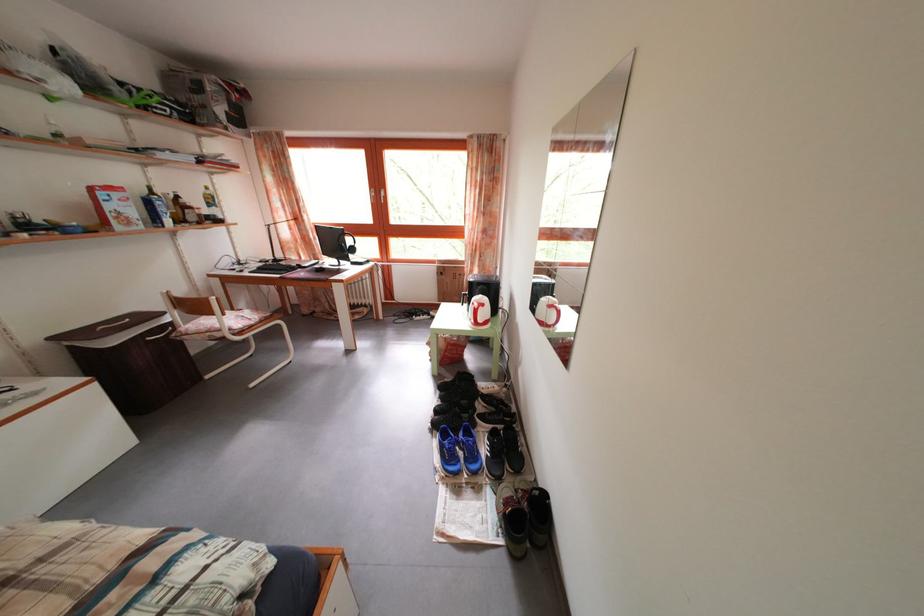
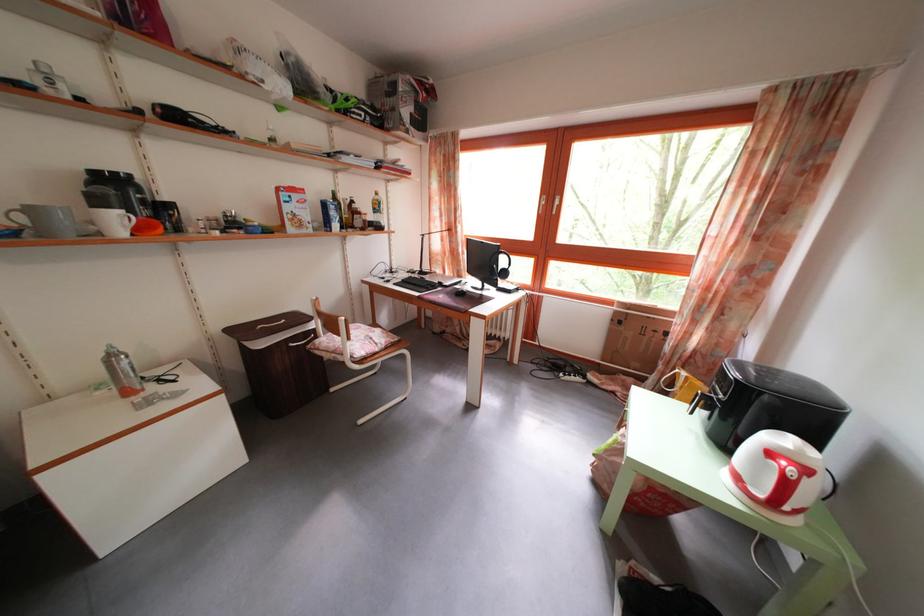
In the second image, find the point that corresponds to the point at 43,400 in the first image.

(185, 402)